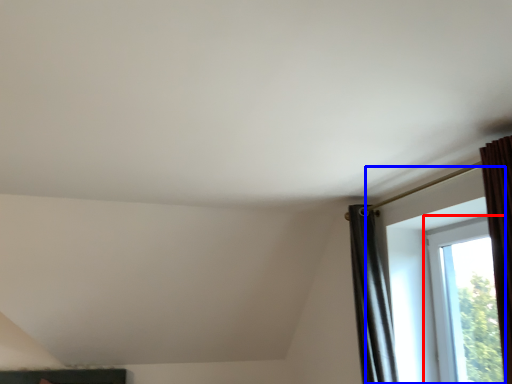
Question: Among these objects, which one is farthest to the camera, window (highlighted by a red box) or window (highlighted by a blue box)?

Choices:
 (A) window
 (B) window

Answer: (A)